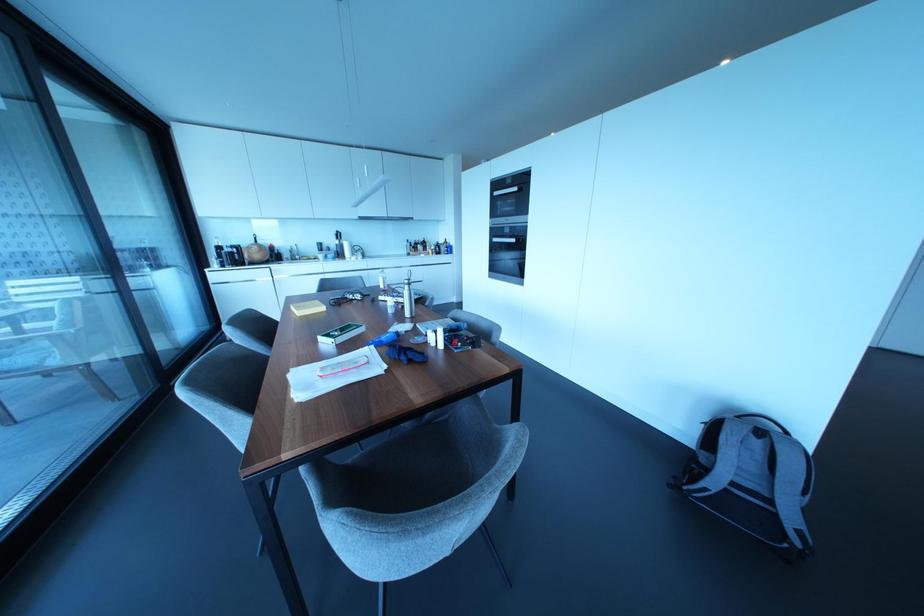
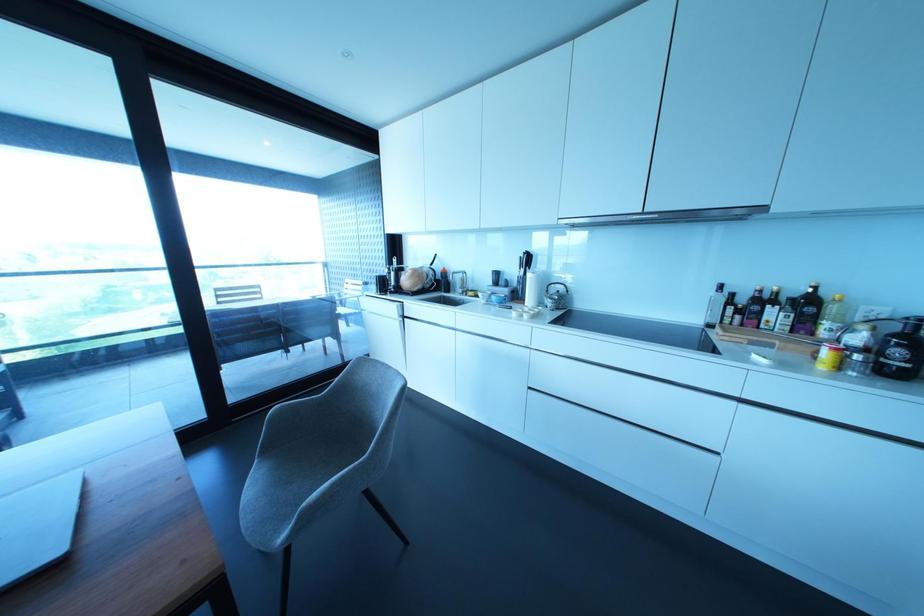
In the second image, find the point that corresponds to (x=329, y=254) in the first image.

(492, 297)